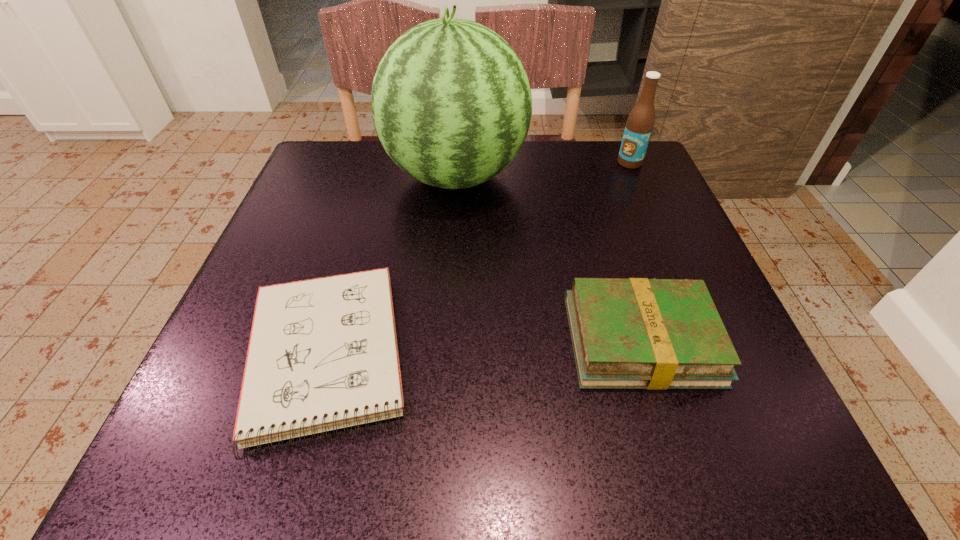
The image size is (960, 540). In the image, there is a desktop. What are the coordinates of `vacant space at the far right corner` in the screenshot? It's located at pos(588,181).

Image resolution: width=960 pixels, height=540 pixels. In the image, there is a desktop. Find the location of `vacant region at the near right corner`. vacant region at the near right corner is located at coordinates (763, 434).

You are a GUI agent. You are given a task and a screenshot of the screen. Output one action in this format:
    pyautogui.click(x=<x>, y=<y>)
    Task: Click on the free space between the tallest object and the shortest object
    
    Given the screenshot: What is the action you would take?
    pyautogui.click(x=391, y=265)

This screenshot has height=540, width=960. In order to click on free space between the second shortest object and the beer bottle in this screenshot , I will do `click(636, 251)`.

Locate an element on the screen. vacant area between the notepad and the beer bottle is located at coordinates (477, 258).

Identify the location of free space between the second shortest object and the notepad. The width and height of the screenshot is (960, 540). (483, 347).

Where is `free area in between the notepad and the book`? The image size is (960, 540). free area in between the notepad and the book is located at coordinates (483, 347).

The width and height of the screenshot is (960, 540). Find the location of `unoccupied position between the book and the beer bottle`. unoccupied position between the book and the beer bottle is located at coordinates (636, 251).

This screenshot has height=540, width=960. Identify the location of free point between the third tallest object and the notepad. (483, 347).

Identify the location of blank region between the notepad and the book. The image size is (960, 540). (483, 347).